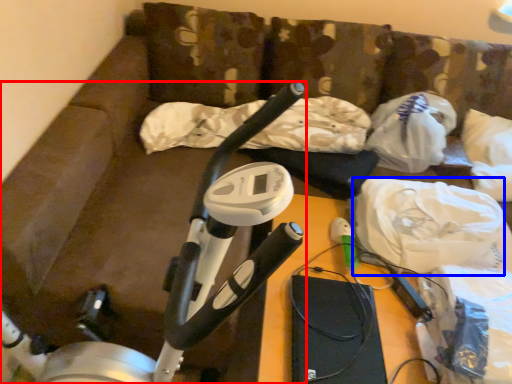
Question: Among these objects, which one is nearest to the camera, stationary bicycle (highlighted by a red box) or material (highlighted by a blue box)?

Choices:
 (A) stationary bicycle
 (B) material

Answer: (A)